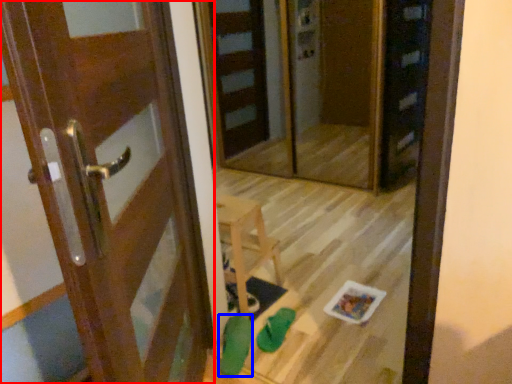
Question: Which point is further to the camera, door (highlighted by a red box) or shoe (highlighted by a blue box)?

Choices:
 (A) door
 (B) shoe

Answer: (B)